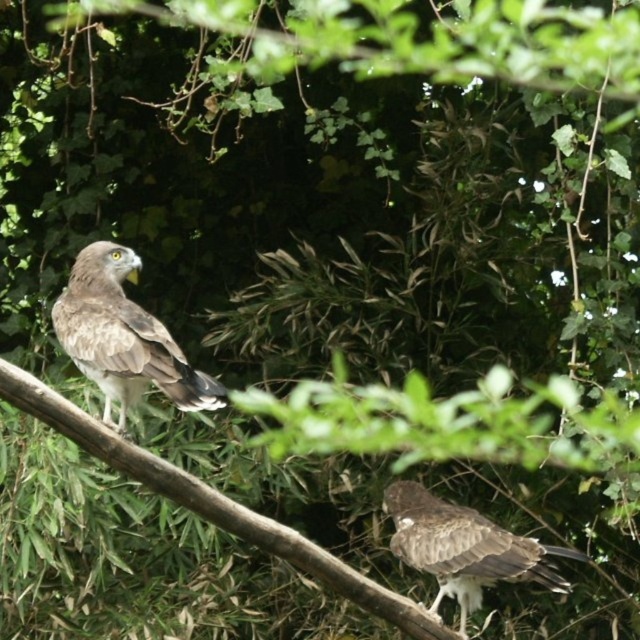
You are a birdwatcher trying to capture both the brown wood at left and the brown feathered eagle at upper left in your camera frame. Which object occupies a larger portion of the horizontal space in the image?

The brown wood at left occupies a larger portion of the horizontal space in the image since its width surpasses that of the brown feathered eagle at upper left.

In the scene described, there is brown wood at left and a brown feathered eagle at upper left. Which object is positioned more to the right side of the image?

The brown wood at left is positioned to the right of the brown feathered eagle at upper left, so the brown wood at left is more to the right side of the image.